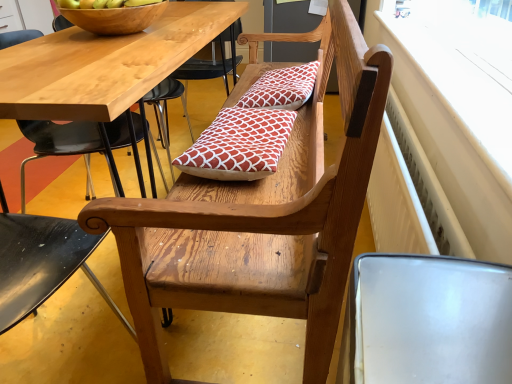
Question: From the image's perspective, is red printed cushion at center, which is the 1th pillow from front to back, beneath white plastic radiator at upper right?

Choices:
 (A) yes
 (B) no

Answer: (A)

Question: From the image's perspective, is red printed cushion at center, which is counted as the 2th pillow, starting from the top, above white plastic radiator at upper right?

Choices:
 (A) no
 (B) yes

Answer: (A)

Question: From a real-world perspective, is red printed cushion at center, which is counted as the 2th pillow, starting from the top, below white plastic radiator at upper right?

Choices:
 (A) yes
 (B) no

Answer: (A)

Question: Are red printed cushion at center, which is counted as the 2th pillow, starting from the top, and white plastic radiator at upper right making contact?

Choices:
 (A) no
 (B) yes

Answer: (A)

Question: From a real-world perspective, is red printed cushion at center, positioned as the 2th pillow in back-to-front order, over white plastic radiator at upper right?

Choices:
 (A) no
 (B) yes

Answer: (A)

Question: Can you confirm if red printed cushion at center, positioned as the 2th pillow in back-to-front order, is taller than white plastic radiator at upper right?

Choices:
 (A) no
 (B) yes

Answer: (B)

Question: Does wooden bench at center lie in front of red printed cushion at center, the second pillow ordered from the bottom?

Choices:
 (A) yes
 (B) no

Answer: (A)

Question: From a real-world perspective, is wooden bench at center positioned under red printed cushion at center, the 1th pillow viewed from the back, based on gravity?

Choices:
 (A) yes
 (B) no

Answer: (A)

Question: Are wooden bench at center and red printed cushion at center, the second pillow ordered from the bottom, making contact?

Choices:
 (A) no
 (B) yes

Answer: (A)

Question: Is red printed cushion at center, the second pillow ordered from the bottom, surrounded by wooden bench at center?

Choices:
 (A) yes
 (B) no

Answer: (A)

Question: From the image's perspective, does wooden bench at center appear lower than red printed cushion at center, the 1th pillow viewed from the back?

Choices:
 (A) no
 (B) yes

Answer: (B)

Question: From a real-world perspective, is wooden bench at center on red printed cushion at center, positioned as the 2th pillow in front-to-back order?

Choices:
 (A) yes
 (B) no

Answer: (B)

Question: From a real-world perspective, is wooden bowl at upper left below red printed cushion at center, positioned as the 2th pillow in back-to-front order?

Choices:
 (A) no
 (B) yes

Answer: (A)